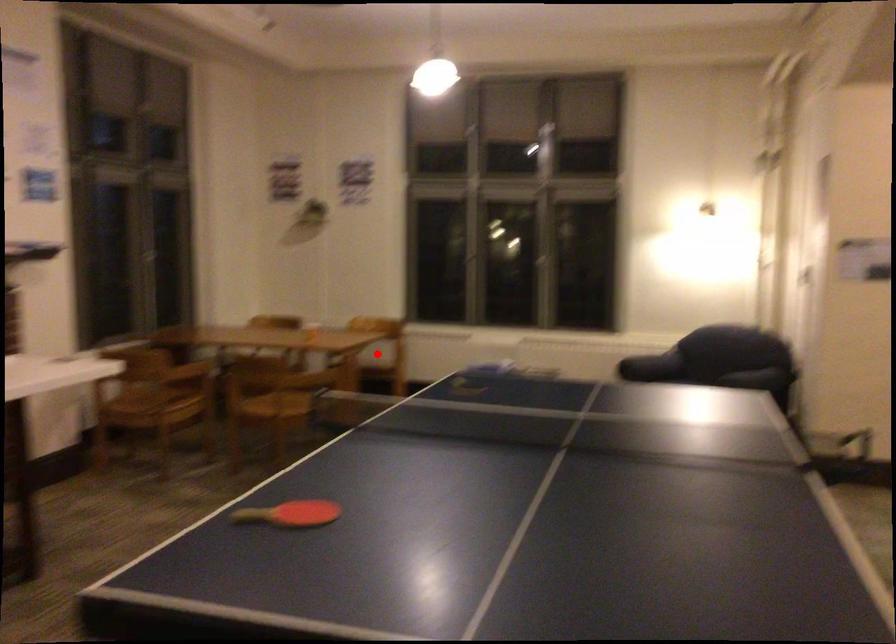
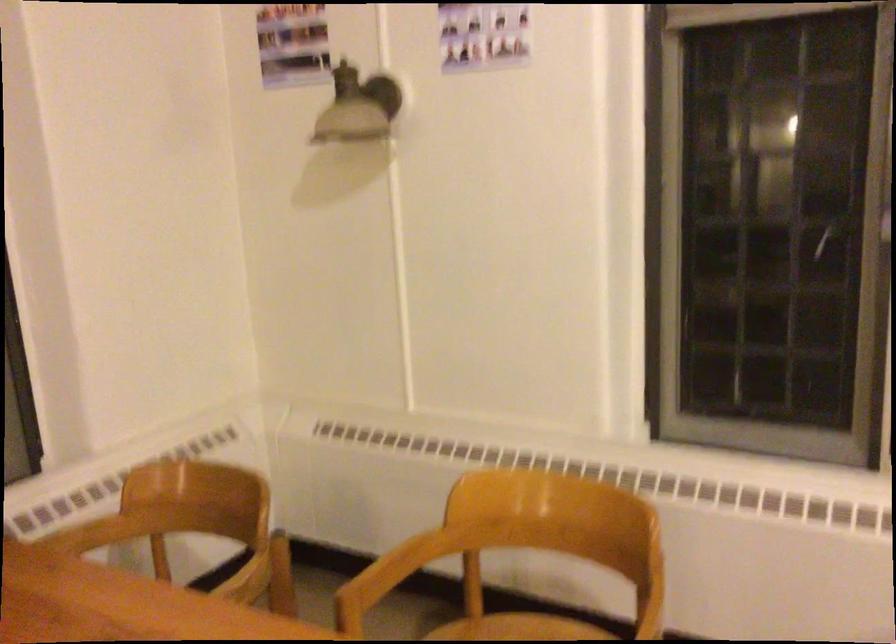
The point at the highlighted location is marked in the first image. Where is the corresponding point in the second image?

(517, 629)